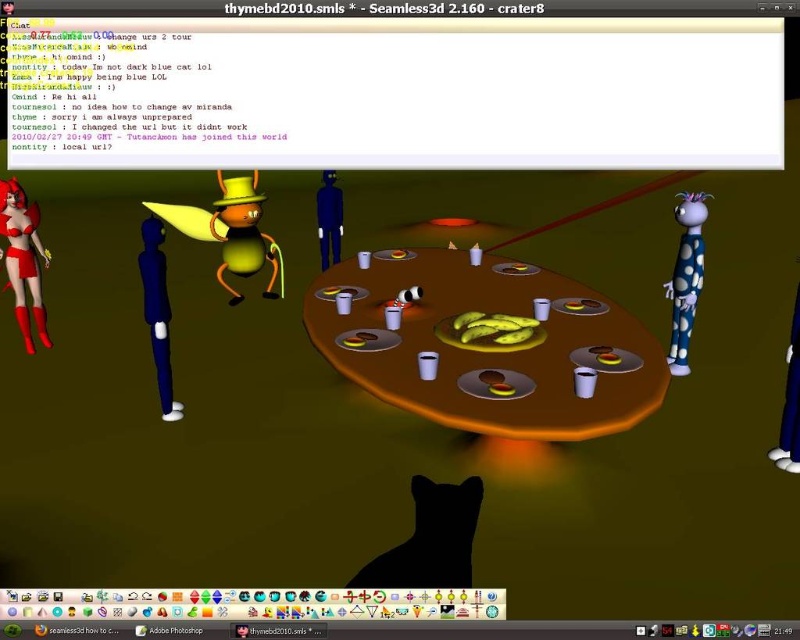
Question: Is brown wooden table at center thinner than black matte cat at lower center?

Choices:
 (A) yes
 (B) no

Answer: (B)

Question: Is transparent plastic chat window at upper center smaller than brown wooden table at center?

Choices:
 (A) yes
 (B) no

Answer: (A)

Question: Based on their relative distances, which object is nearer to the transparent plastic chat window at upper center?

Choices:
 (A) black matte cat at lower center
 (B) brown wooden table at center

Answer: (A)

Question: Does transparent plastic chat window at upper center lie in front of brown wooden table at center?

Choices:
 (A) yes
 (B) no

Answer: (A)

Question: Which object is closer to the camera taking this photo?

Choices:
 (A) brown wooden table at center
 (B) black matte cat at lower center

Answer: (B)

Question: Which is nearer to the transparent plastic chat window at upper center?

Choices:
 (A) black matte cat at lower center
 (B) brown wooden table at center

Answer: (A)